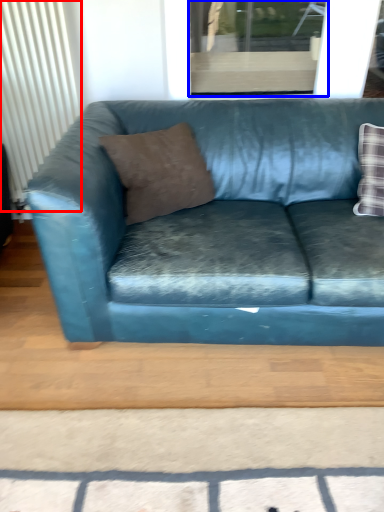
Question: Which object is closer to the camera taking this photo, radiator (highlighted by a red box) or window (highlighted by a blue box)?

Choices:
 (A) radiator
 (B) window

Answer: (A)